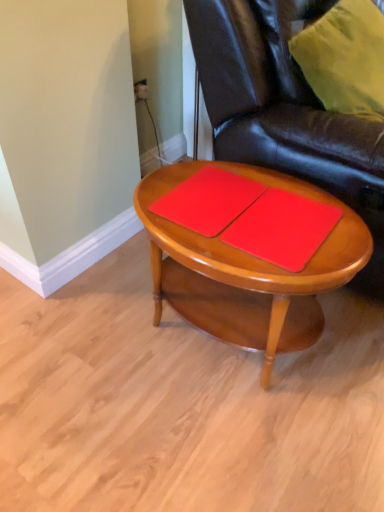
Question: From a real-world perspective, is red matte notebook at center, acting as the 2th notebook starting from the left, on matte wood coffee table at center?

Choices:
 (A) no
 (B) yes

Answer: (B)

Question: Is red matte notebook at center, acting as the 2th notebook starting from the left, not near matte wood coffee table at center?

Choices:
 (A) no
 (B) yes

Answer: (A)

Question: Can you confirm if red matte notebook at center, acting as the 2th notebook starting from the left, is smaller than matte wood coffee table at center?

Choices:
 (A) yes
 (B) no

Answer: (A)

Question: Is the depth of red matte notebook at center, which appears as the first notebook when viewed from the right, less than that of matte wood coffee table at center?

Choices:
 (A) yes
 (B) no

Answer: (B)

Question: From the image's perspective, is red matte notebook at center, acting as the 2th notebook starting from the left, on top of matte wood coffee table at center?

Choices:
 (A) no
 (B) yes

Answer: (B)

Question: Could matte wood coffee table at center be considered to be inside red matte notebook at center, which appears as the first notebook when viewed from the right?

Choices:
 (A) yes
 (B) no

Answer: (B)

Question: Would you say glossy leather chair at center is outside matte wood coffee table at center?

Choices:
 (A) no
 (B) yes

Answer: (B)

Question: Is glossy leather chair at center positioned with its back to matte wood coffee table at center?

Choices:
 (A) no
 (B) yes

Answer: (A)

Question: Is glossy leather chair at center aimed at matte wood coffee table at center?

Choices:
 (A) no
 (B) yes

Answer: (A)

Question: Is glossy leather chair at center at the right side of matte wood coffee table at center?

Choices:
 (A) no
 (B) yes

Answer: (B)

Question: Does glossy leather chair at center have a greater width compared to matte wood coffee table at center?

Choices:
 (A) yes
 (B) no

Answer: (A)

Question: Does glossy leather chair at center have a smaller size compared to matte wood coffee table at center?

Choices:
 (A) no
 (B) yes

Answer: (A)

Question: Are matte wood coffee table at center and glossy leather chair at center beside each other?

Choices:
 (A) yes
 (B) no

Answer: (B)